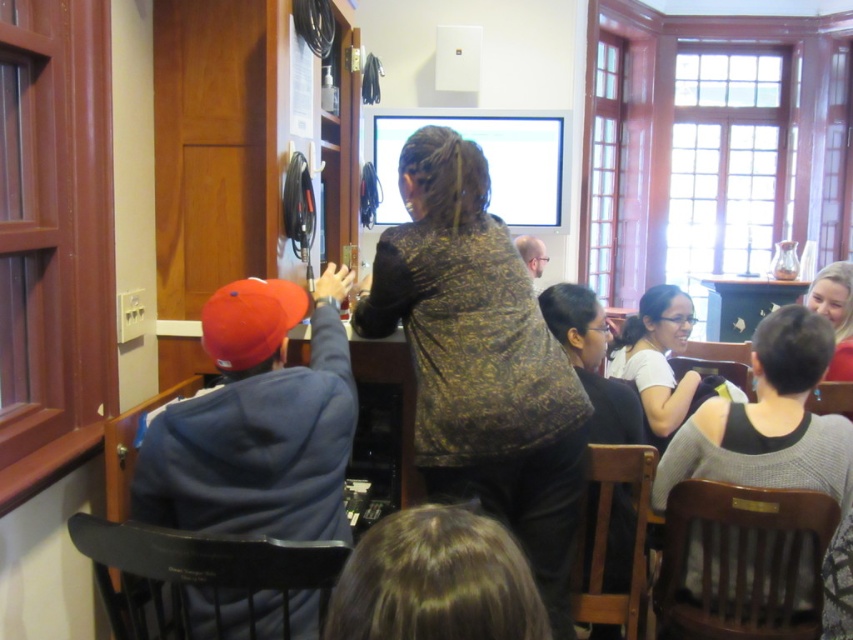
Can you confirm if white matte shirt at center is positioned to the left of wooden table at upper right?

Yes, white matte shirt at center is to the left of wooden table at upper right.

Is white matte shirt at center to the right of wooden table at upper right from the viewer's perspective?

No, white matte shirt at center is not to the right of wooden table at upper right.

Which is in front, point (689, 371) or point (721, 332)?

Point (689, 371)

You are a GUI agent. You are given a task and a screenshot of the screen. Output one action in this format:
    pyautogui.click(x=<x>, y=<y>)
    Task: Click on the white matte shirt at center
    Image resolution: width=853 pixels, height=640 pixels.
    Given the screenshot: What is the action you would take?
    pyautogui.click(x=665, y=362)

Is gray knit sweater at lower right taller than matte black hair at upper right?

Correct, gray knit sweater at lower right is much taller as matte black hair at upper right.

Between point (712, 481) and point (845, 368), which one is positioned in front?

Point (712, 481)

Where is `gray knit sweater at lower right`? This screenshot has width=853, height=640. gray knit sweater at lower right is located at coordinates (769, 420).

Does gray knit sweater at lower right appear on the left side of white matte shirt at center?

Yes, gray knit sweater at lower right is to the left of white matte shirt at center.

The height and width of the screenshot is (640, 853). Identify the location of gray knit sweater at lower right. (769, 420).

Is point (689, 436) closer to camera compared to point (651, 429)?

That is True.

This screenshot has height=640, width=853. What are the coordinates of `gray knit sweater at lower right` in the screenshot? It's located at (769, 420).